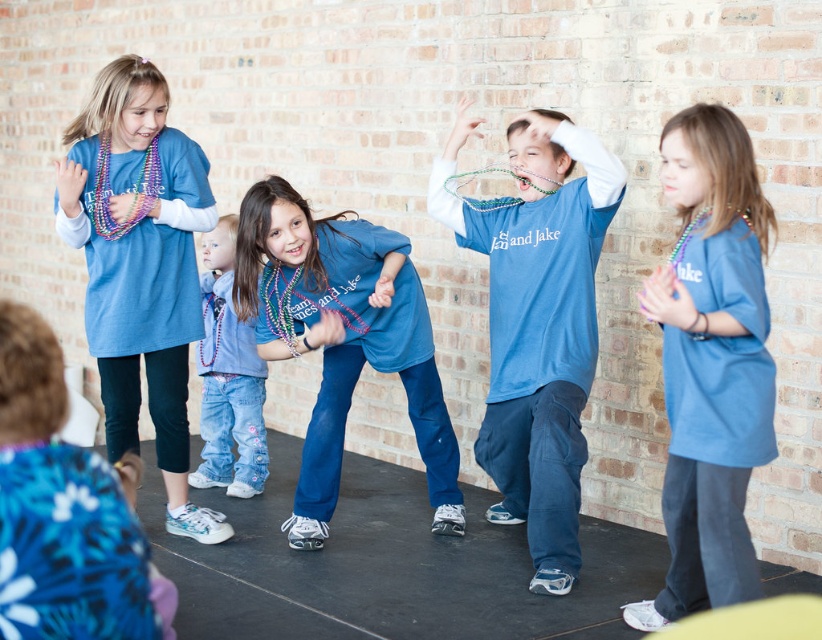
Is point (169, 253) positioned in front of point (262, 394)?

Yes, it is.

Which is in front, point (169, 408) or point (220, 412)?

Positioned in front is point (169, 408).

Is point (111, 193) positioned after point (257, 483)?

That is False.

Identify the location of matte blue shirt at left. This screenshot has width=822, height=640. (139, 266).

How far apart are matte blue shirt at center and matte blue shirt at left?

A distance of 6.00 feet exists between matte blue shirt at center and matte blue shirt at left.

Who is positioned more to the left, matte blue shirt at center or matte blue shirt at left?

matte blue shirt at left is more to the left.

Is point (504, 324) positioned in front of point (185, 272)?

Yes, point (504, 324) is in front of point (185, 272).

Find the location of a particular element. matte blue shirt at center is located at coordinates (538, 323).

Which of these two, matte blue shirt at right or denim jeans at center, stands taller?

With more height is matte blue shirt at right.

Between matte blue shirt at right and denim jeans at center, which one has less height?

denim jeans at center

Is point (760, 362) farther from viewer compared to point (259, 388)?

No, (760, 362) is in front of (259, 388).

You are a GUI agent. You are given a task and a screenshot of the screen. Output one action in this format:
    pyautogui.click(x=<x>, y=<y>)
    Task: Click on the matte blue shirt at right
    This screenshot has width=822, height=640.
    Given the screenshot: What is the action you would take?
    pyautogui.click(x=710, y=364)